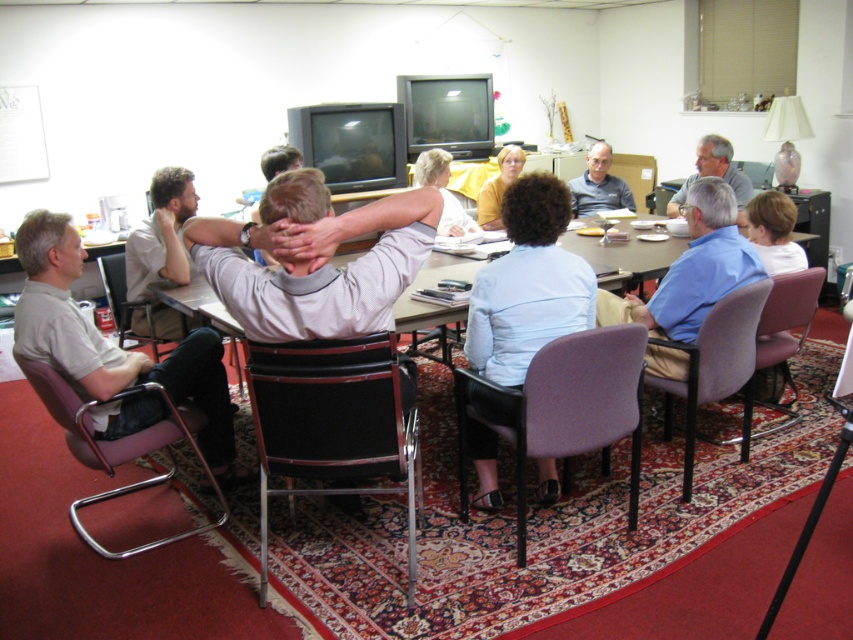
You are organizing a seating arrangement for an event and need to place a large decorative item on the table. The item requires a space that can accommodate the black leather chair at center and the blue shirt at center. Which object should you consider for placement to ensure enough space?

The black leather chair at center has a larger size compared to blue shirt at center, so you should place the large decorative item near the black leather chair at center to ensure there is enough space.

You are organizing a small meeting and need to seat two people. You have a purple fabric chair at center and a matte gray shirt at upper right. Which object takes up more space?

The matte gray shirt at upper right occupies more space than the purple fabric chair at center.